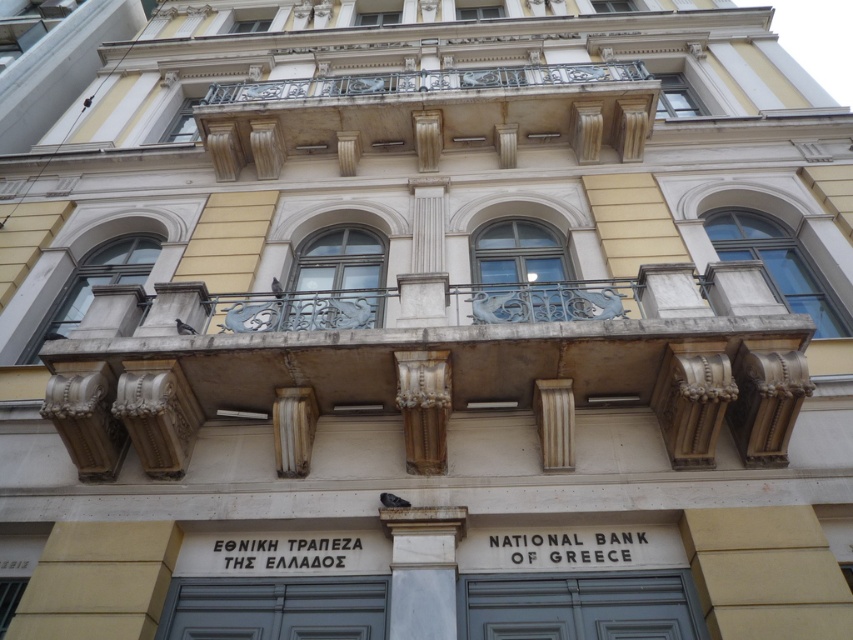
Question: Is gold textured column at center positioned behind smooth beige column at center?

Choices:
 (A) no
 (B) yes

Answer: (A)

Question: Is gold textured balcony at upper center wider than white marble column at center?

Choices:
 (A) yes
 (B) no

Answer: (A)

Question: Which is farther from the gold textured balcony at upper center?

Choices:
 (A) gold textured column at center
 (B) stone balustrade at center

Answer: (A)

Question: Observing the image, what is the correct spatial positioning of stone balustrade at center in reference to gold textured column at center?

Choices:
 (A) left
 (B) right

Answer: (A)

Question: Which point is closer to the camera?

Choices:
 (A) (708, 280)
 (B) (432, 449)
 (C) (554, 426)
 (D) (633, 148)

Answer: (B)

Question: Which of the following is the farthest from the observer?

Choices:
 (A) gold textured column at center
 (B) white marble column at center
 (C) smooth beige column at center

Answer: (C)